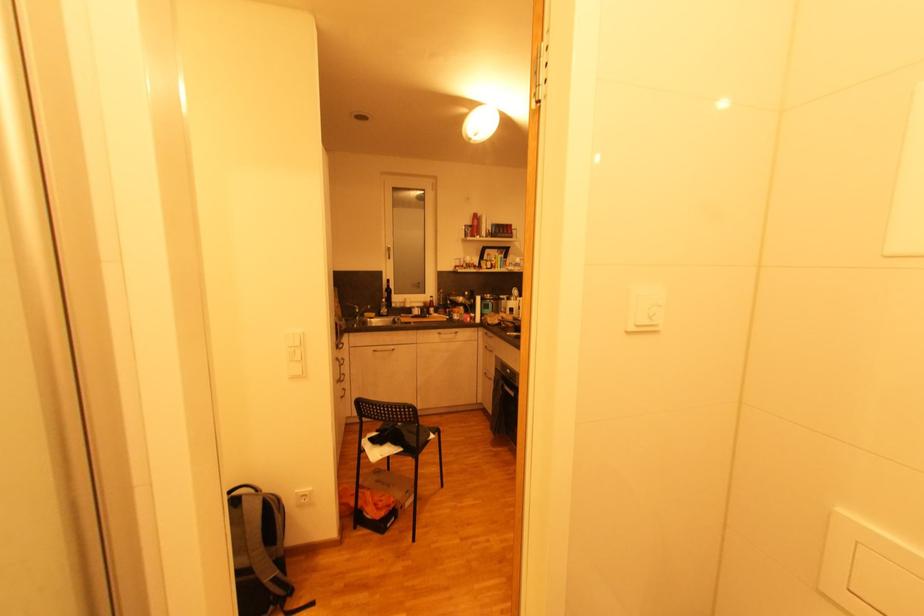
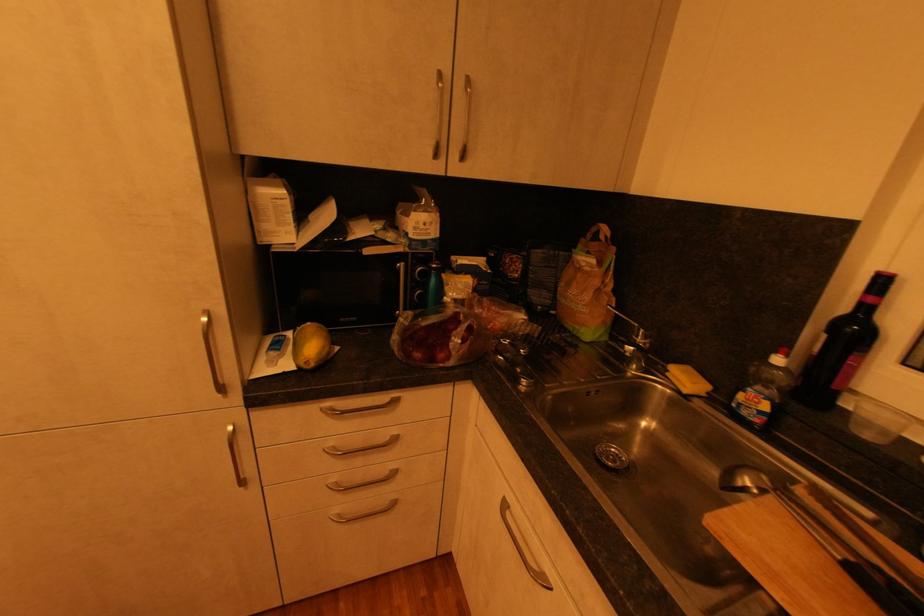
In the second image, find the point that corresponds to [393,282] in the first image.

(889, 282)